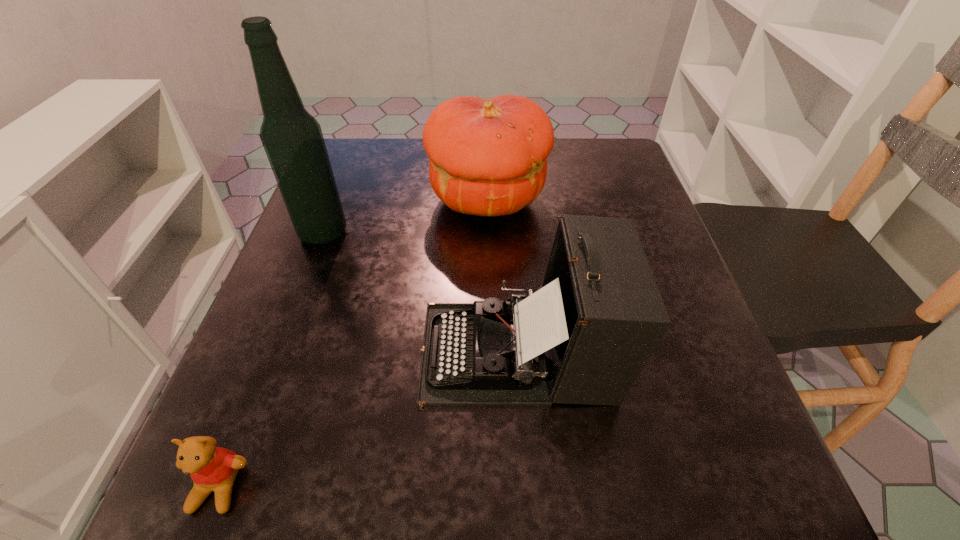
In the image, there is a desktop. In order to click on free space at the far left corner in this screenshot , I will do `click(334, 171)`.

I want to click on vacant area at the far right corner, so click(573, 166).

Where is `empty location between the tallest object and the teddy bear`? The image size is (960, 540). empty location between the tallest object and the teddy bear is located at coordinates (271, 360).

Image resolution: width=960 pixels, height=540 pixels. What are the coordinates of `free spot between the nearest object and the pumpkin` in the screenshot? It's located at (353, 343).

Find the location of a particular element. Image resolution: width=960 pixels, height=540 pixels. vacant space in between the pumpkin and the tallest object is located at coordinates (405, 216).

Identify the location of vacant space in between the pumpkin and the alcohol. This screenshot has height=540, width=960. (405, 216).

This screenshot has height=540, width=960. Identify the location of vacant space in between the alcohol and the nearest object. (271, 360).

Find the location of a particular element. empty space that is in between the alcohol and the nearest object is located at coordinates (271, 360).

The height and width of the screenshot is (540, 960). Identify the location of free area in between the shortest object and the pumpkin. click(x=353, y=343).

Where is `empty location between the shortest object and the alcohol`? empty location between the shortest object and the alcohol is located at coordinates (271, 360).